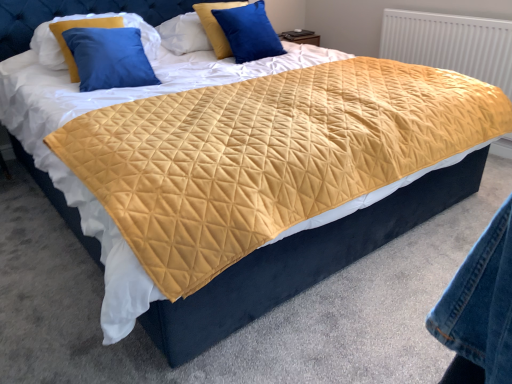
Question: Does blue velvet pillow at upper center, the 1th pillow positioned from the right, appear on the left side of white textured radiator at upper right?

Choices:
 (A) yes
 (B) no

Answer: (A)

Question: Does blue velvet pillow at upper center, arranged as the 3th pillow when viewed from the left, turn towards white textured radiator at upper right?

Choices:
 (A) yes
 (B) no

Answer: (B)

Question: Considering the relative positions of blue velvet pillow at upper center, the 1th pillow positioned from the right, and white textured radiator at upper right in the image provided, is blue velvet pillow at upper center, the 1th pillow positioned from the right, in front of white textured radiator at upper right?

Choices:
 (A) no
 (B) yes

Answer: (B)

Question: Is blue velvet pillow at upper center, the 1th pillow positioned from the right, thinner than white textured radiator at upper right?

Choices:
 (A) yes
 (B) no

Answer: (B)

Question: Is blue velvet pillow at upper center, the 1th pillow positioned from the right, outside white textured radiator at upper right?

Choices:
 (A) no
 (B) yes

Answer: (B)

Question: Looking at their shapes, would you say quilted yellow fabric at center is wider or thinner than white textured radiator at upper right?

Choices:
 (A) thin
 (B) wide

Answer: (B)

Question: Would you say quilted yellow fabric at center is to the left or to the right of white textured radiator at upper right in the picture?

Choices:
 (A) left
 (B) right

Answer: (A)

Question: Looking at the image, does quilted yellow fabric at center seem bigger or smaller compared to white textured radiator at upper right?

Choices:
 (A) big
 (B) small

Answer: (A)

Question: From a real-world perspective, relative to white textured radiator at upper right, is quilted yellow fabric at center vertically above or below?

Choices:
 (A) below
 (B) above

Answer: (A)

Question: Considering the positions of point (438, 23) and point (219, 41), is point (438, 23) closer or farther from the camera than point (219, 41)?

Choices:
 (A) farther
 (B) closer

Answer: (A)

Question: Based on their sizes in the image, would you say white textured radiator at upper right is bigger or smaller than blue velvet pillow at upper center, the second pillow from the right?

Choices:
 (A) small
 (B) big

Answer: (A)

Question: Is white textured radiator at upper right in front of or behind blue velvet pillow at upper center, the second pillow from the right, in the image?

Choices:
 (A) front
 (B) behind

Answer: (A)

Question: From a real-world perspective, relative to blue velvet pillow at upper center, positioned as the second pillow in left-to-right order, is white textured radiator at upper right vertically above or below?

Choices:
 (A) below
 (B) above

Answer: (A)

Question: Considering their positions, is blue velvet pillow at upper center, the 1th pillow positioned from the right, located in front of or behind quilted yellow fabric at center?

Choices:
 (A) front
 (B) behind

Answer: (B)

Question: Considering the positions of blue velvet pillow at upper center, arranged as the 3th pillow when viewed from the left, and quilted yellow fabric at center in the image, is blue velvet pillow at upper center, arranged as the 3th pillow when viewed from the left, bigger or smaller than quilted yellow fabric at center?

Choices:
 (A) small
 (B) big

Answer: (A)